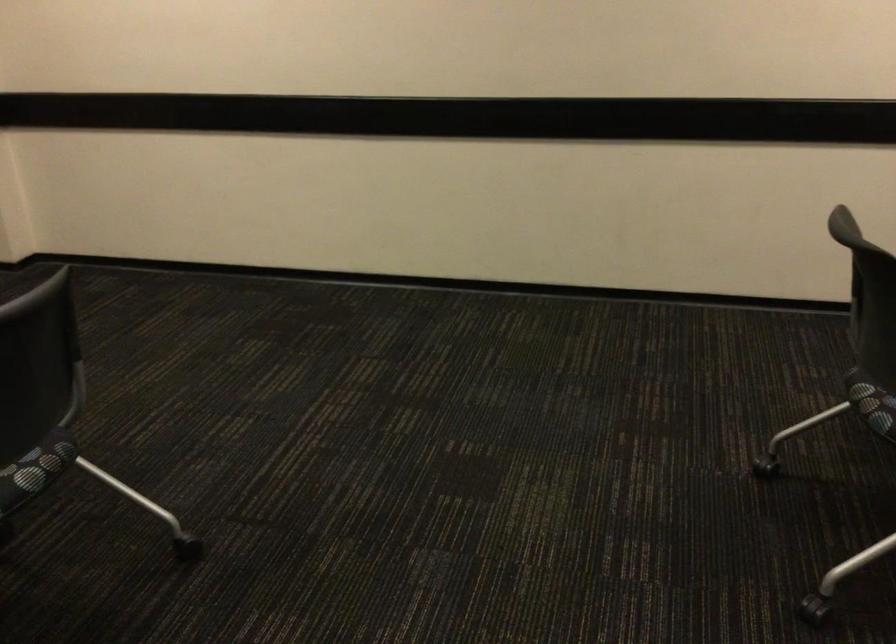
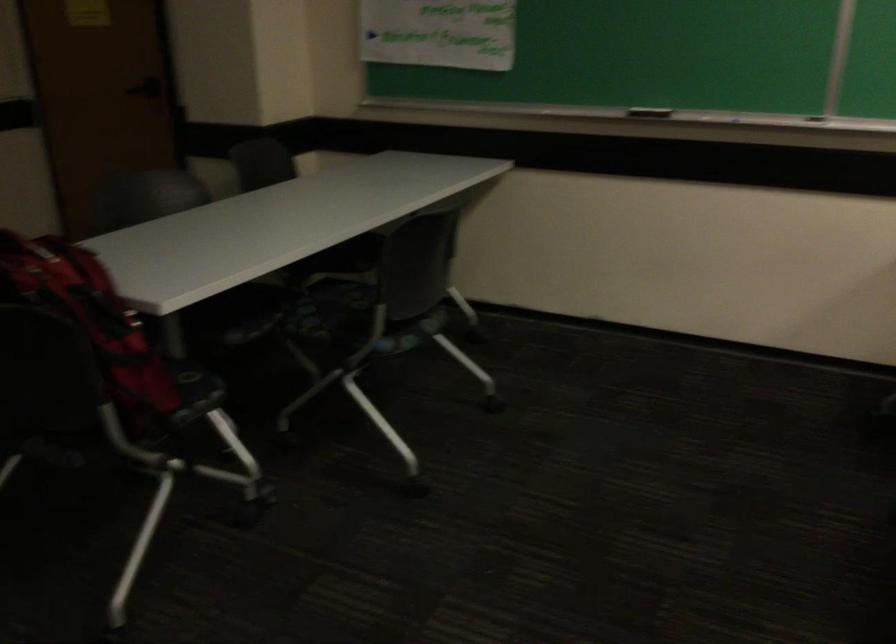
How did the camera likely rotate?

The camera's rotation is toward left-down.